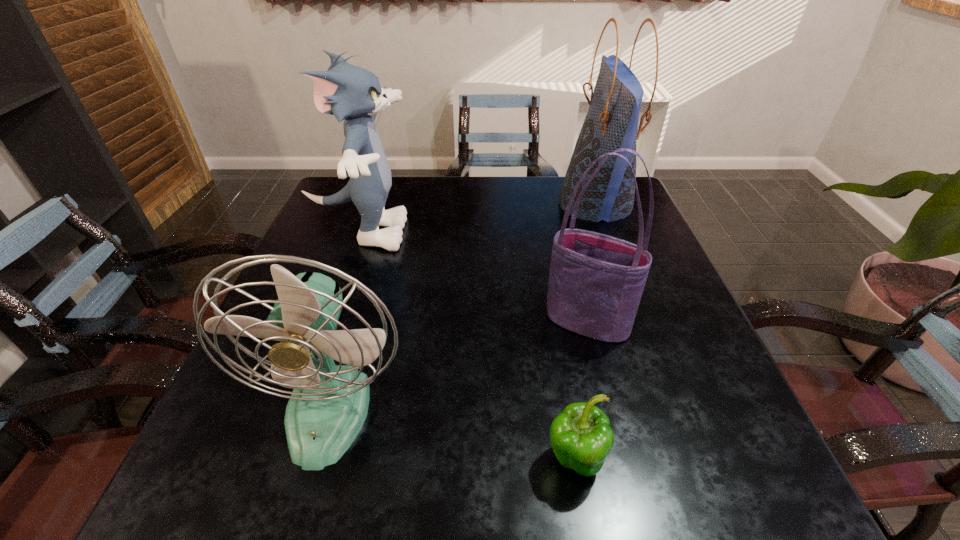
Find the location of a particular element. This screenshot has width=960, height=540. shopping bag is located at coordinates (611, 123).

I want to click on cat, so click(348, 92).

Identify the location of tote bag. The image size is (960, 540). (596, 281).

Locate an element on the screen. The image size is (960, 540). fan is located at coordinates (328, 406).

Locate an element on the screen. the shortest object is located at coordinates (581, 437).

Image resolution: width=960 pixels, height=540 pixels. I want to click on free space located on the left of the shopping bag, so click(434, 204).

Image resolution: width=960 pixels, height=540 pixels. Identify the location of free space located 0.290m on the front-facing side of the cat. (520, 233).

You are a GUI agent. You are given a task and a screenshot of the screen. Output one action in this format:
    pyautogui.click(x=<x>, y=<y>)
    Task: Click on the vacant space located on the left of the third nearest object
    
    Given the screenshot: What is the action you would take?
    pyautogui.click(x=492, y=322)

This screenshot has width=960, height=540. I want to click on vacant space situated 0.050m in front of the fan, directing airflow, so click(x=302, y=505).

Locate an element on the screen. Image resolution: width=960 pixels, height=540 pixels. vacant space located 0.170m on the left of the shortest object is located at coordinates (435, 461).